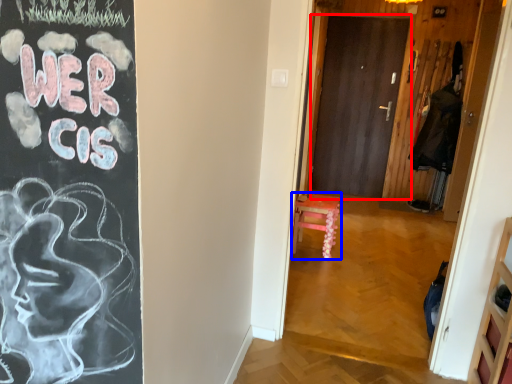
Question: Which object appears closest to the camera in this image, door (highlighted by a red box) or furniture (highlighted by a blue box)?

Choices:
 (A) door
 (B) furniture

Answer: (B)